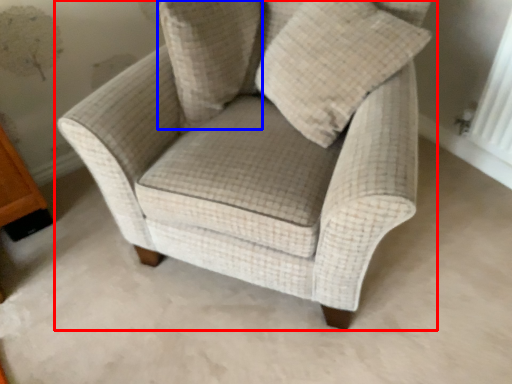
Question: Which object appears farthest to the camera in this image, chair (highlighted by a red box) or pillow (highlighted by a blue box)?

Choices:
 (A) chair
 (B) pillow

Answer: (B)